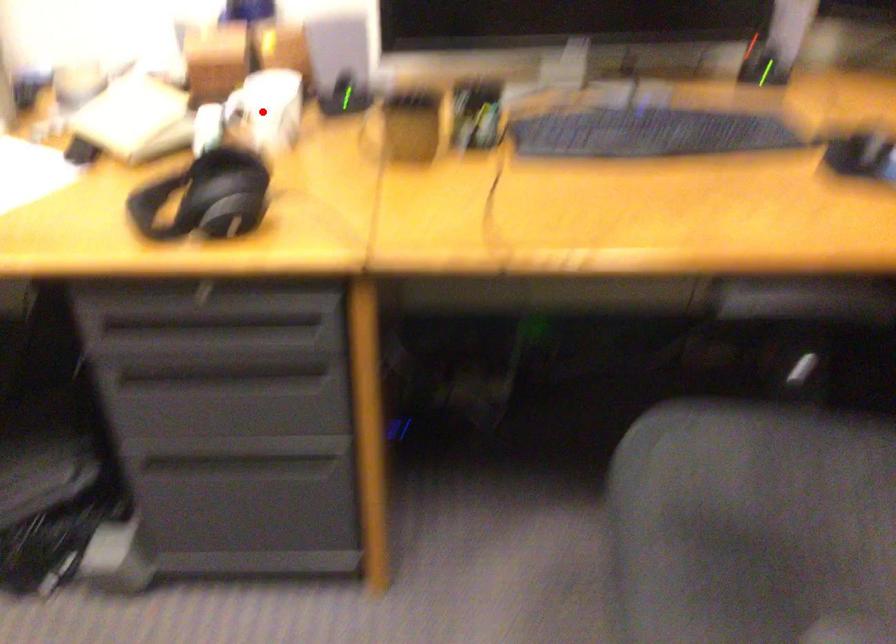
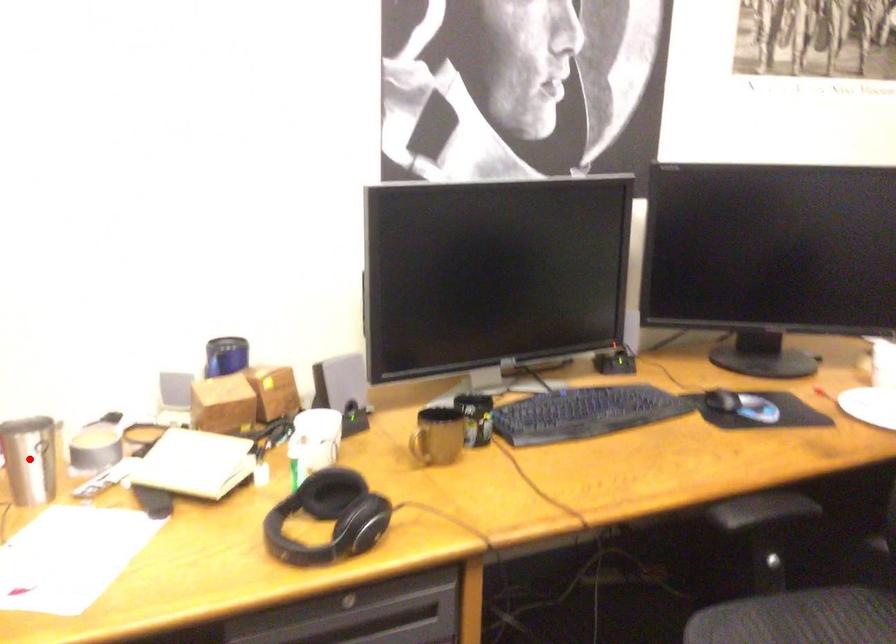
I am providing you with two images of the same scene from different viewpoints. A red point is marked on the first image and another point is marked on the second image. Is the marked point in image1 the same physical position as the marked point in image2?

No